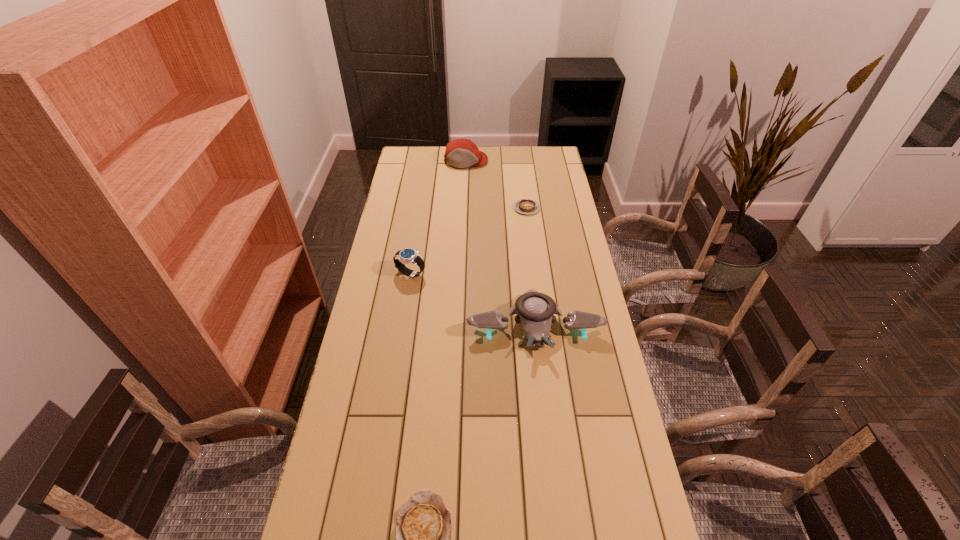
Locate an element on the screen. The image size is (960, 540). the farthest object is located at coordinates (460, 153).

This screenshot has width=960, height=540. I want to click on the third farthest object, so click(408, 255).

Find the location of `drone`. drone is located at coordinates (535, 311).

I want to click on the fourth nearest object, so click(x=525, y=206).

Find the location of a particular element. the right quiche is located at coordinates (525, 206).

Locate an element on the screen. The image size is (960, 540). vacant space located on the front-facing side of the cap is located at coordinates (465, 189).

The width and height of the screenshot is (960, 540). I want to click on vacant space located on the back of the watch, so click(x=421, y=206).

This screenshot has width=960, height=540. In order to click on free space located 0.300m on the front-facing side of the drone in this screenshot , I will do 549,457.

At what (x,y) coordinates should I click in order to perform the action: click on vacant region located 0.190m on the back of the farther quiche. Please return your answer as a coordinate pair (x, y). Looking at the image, I should click on (522, 177).

Locate an element on the screen. The height and width of the screenshot is (540, 960). object located in the far edge section of the desktop is located at coordinates (460, 153).